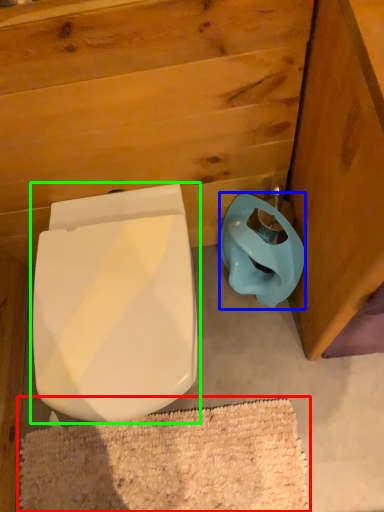
Question: Which object is positioned farthest from bath mat (highlighted by a red box)? Select from toilet bowl (highlighted by a blue box) and toilet (highlighted by a green box).

Choices:
 (A) toilet bowl
 (B) toilet

Answer: (A)